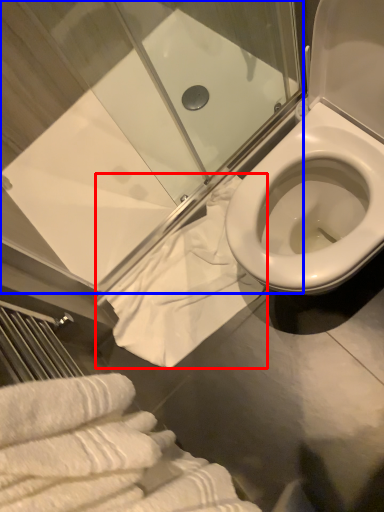
Question: Which of the following is the closest to the observer, bath towel (highlighted by a red box) or shower door (highlighted by a blue box)?

Choices:
 (A) bath towel
 (B) shower door

Answer: (B)